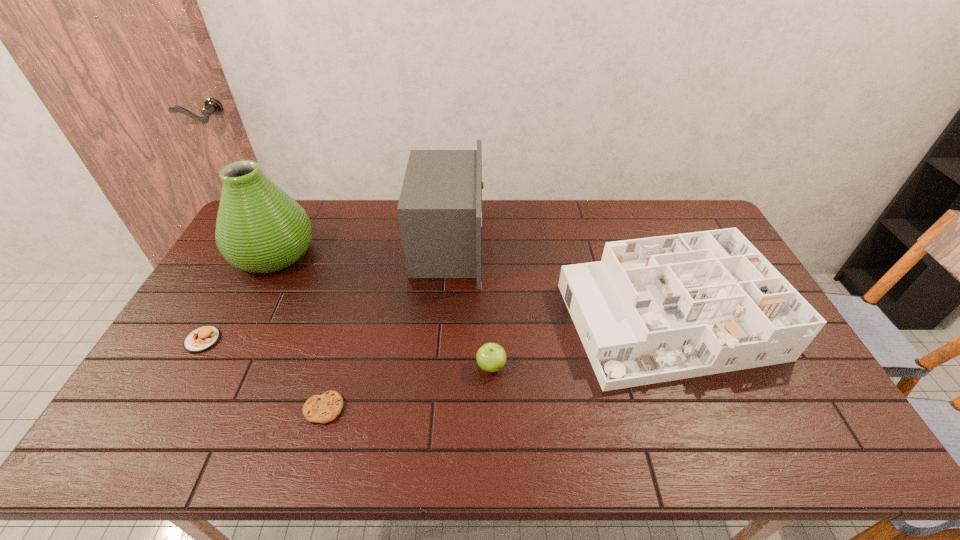
Locate an element on the screen. This screenshot has width=960, height=540. vase is located at coordinates (260, 229).

Find the location of a particular element. The width and height of the screenshot is (960, 540). the second tallest object is located at coordinates (x=440, y=207).

Locate an element on the screen. the third tallest object is located at coordinates (657, 309).

Find the location of a particular element. the rightmost object is located at coordinates (657, 309).

Image resolution: width=960 pixels, height=540 pixels. I want to click on apple, so click(491, 357).

Find the location of `the second shortest object`. the second shortest object is located at coordinates coord(202,338).

The width and height of the screenshot is (960, 540). I want to click on the shortest object, so click(324, 408).

The width and height of the screenshot is (960, 540). In order to click on cookie in this screenshot , I will do `click(324, 408)`.

Where is `vacant space located 0.370m on the front of the vase`? vacant space located 0.370m on the front of the vase is located at coordinates (207, 383).

Locate an element on the screen. The height and width of the screenshot is (540, 960). free location located on the front-facing side of the microwave oven is located at coordinates (561, 244).